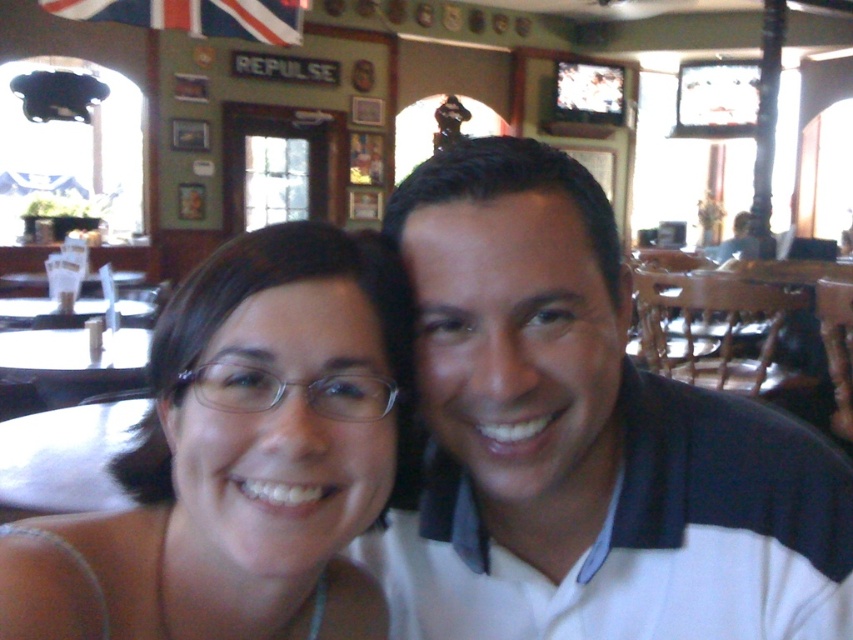
You are a photographer adjusting the focus on your camera. You notice the white cotton shirt at center and the matte white glasses at center in the frame. Which object should you focus on first if you want to ensure the larger object is sharp?

The white cotton shirt at center is bigger than the matte white glasses at center, so you should focus on the white cotton shirt at center first to ensure the larger object is sharp.

You are trying to locate the white cotton shirt at center in the image. According to the coordinates provided, where is it positioned?

The white cotton shirt at center is positioned at coordinates point (584, 440).

You are a photographer trying to capture a candid shot of the two people in the scene. You want to ensure that the white cotton shirt at center and the matte white glasses at center are both in focus. Since you can only focus on one subject at a time, which object should you prioritize focusing on to ensure the other is also in focus due to their spatial relationship?

You should focus on the matte white glasses at center because the white cotton shirt at center is to the right of matte white glasses at center, meaning they are close enough in proximity that focusing on the glasses will likely keep the shirt in focus as well.